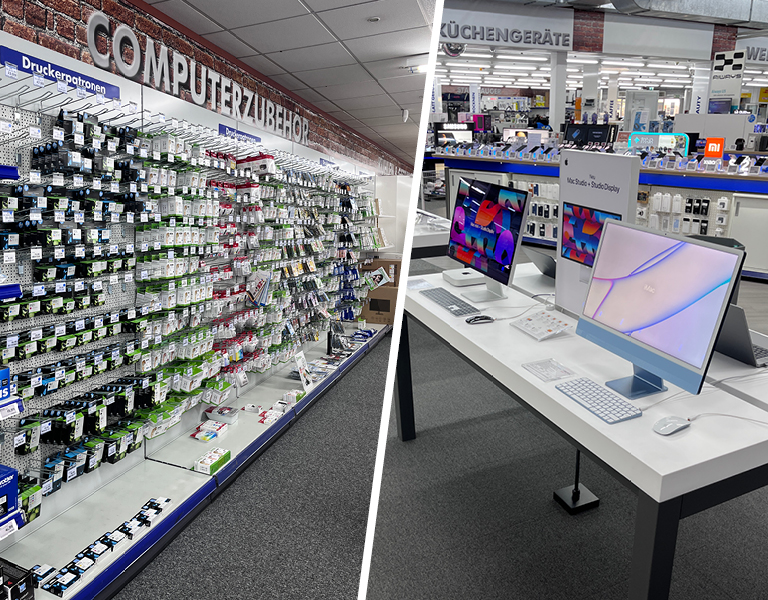
At what (x,y) coordinates should I click in order to perform the action: click on computers. Please return your answer as a coordinate pair (x, y). This screenshot has width=768, height=600. Looking at the image, I should click on (682, 298).